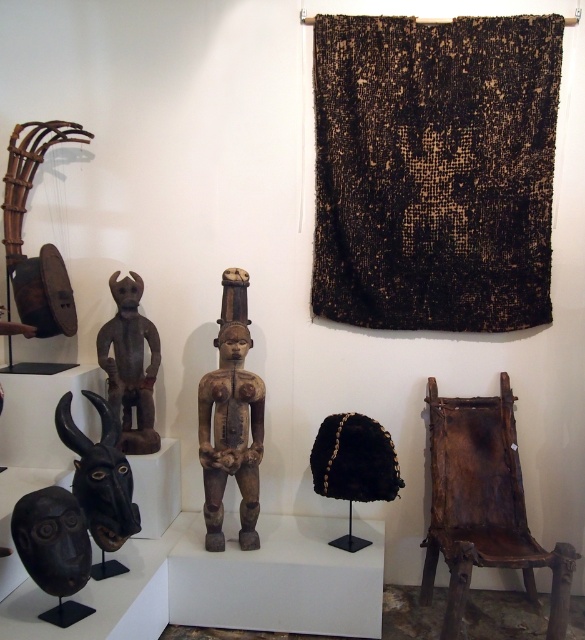
You are a museum visitor standing in front of the display. You notice the black woven cloth at upper center and the brown wooden figure at center. Which object is closer to you?

The black woven cloth at upper center is closer to you because it is further to the viewer than the brown wooden figure at center.

You are a museum curator arranging an exhibit. You have a black woven cloth at upper center and a brown wooden figure at left. Which object is wider?

The black woven cloth at upper center is wider than the brown wooden figure at left.